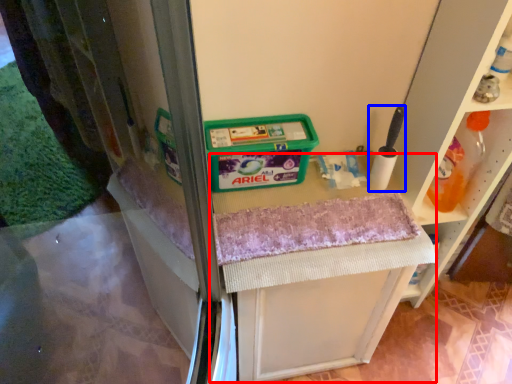
Question: Which object appears closest to the camera in this image, vanity (highlighted by a red box) or brush (highlighted by a blue box)?

Choices:
 (A) vanity
 (B) brush

Answer: (B)